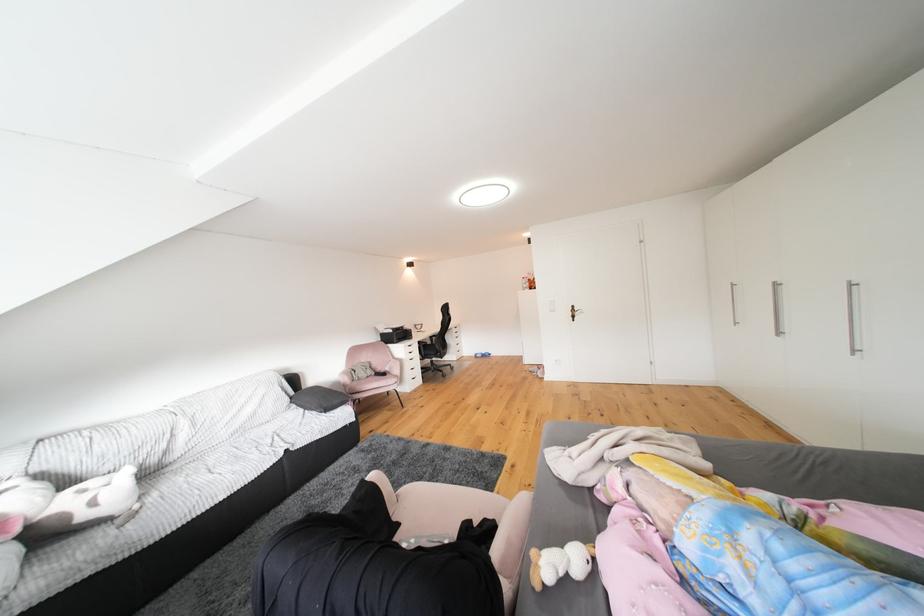
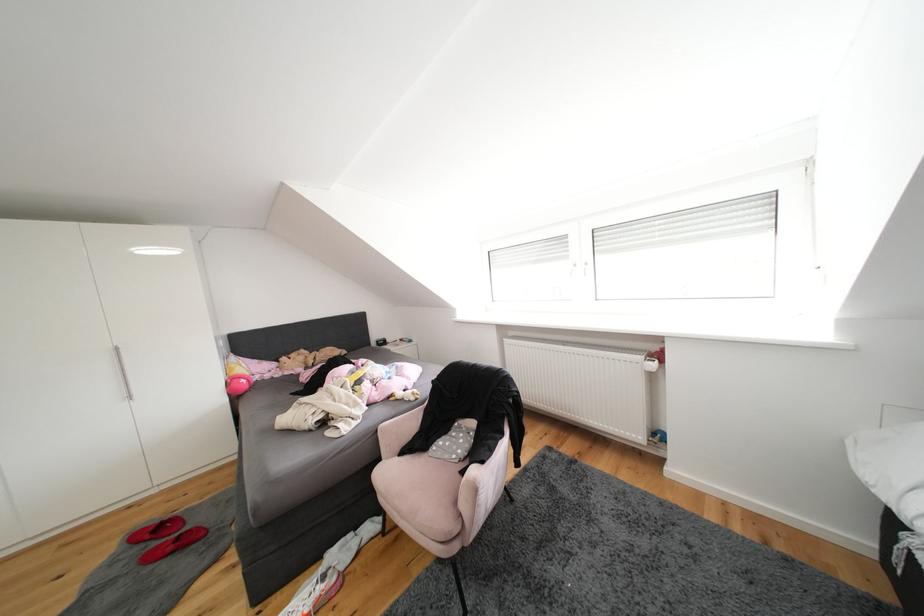
The point at (421, 545) is marked in the first image. Where is the corresponding point in the second image?

(464, 460)